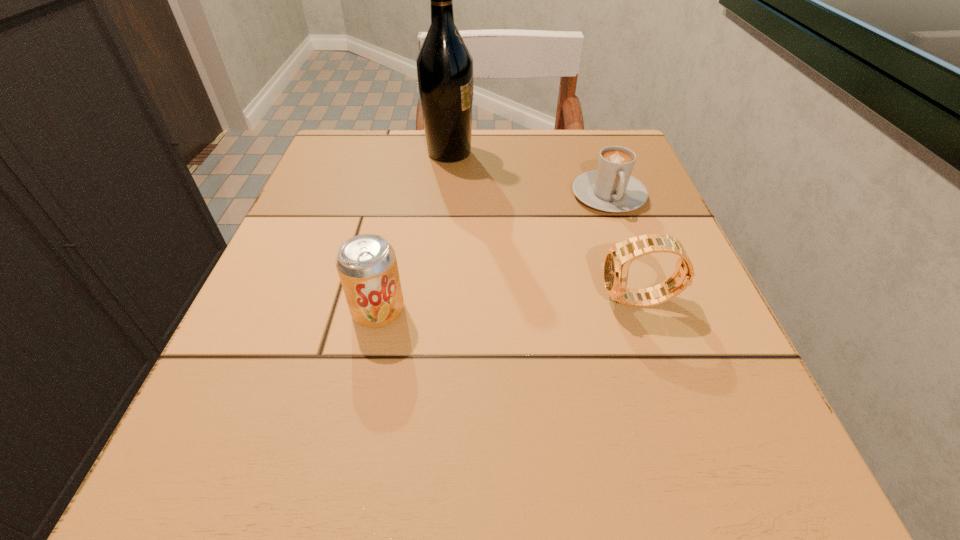
Locate an element on the screen. free space located 0.100m on the face of the watch is located at coordinates (534, 301).

This screenshot has height=540, width=960. Identify the location of vacant space located to the right of the cappuccino. (671, 370).

At what (x,y) coordinates should I click in order to perform the action: click on wine bottle that is at the far edge. Please return your answer as a coordinate pair (x, y). Looking at the image, I should click on (444, 64).

Locate an element on the screen. cappuccino at the far edge is located at coordinates (611, 188).

Where is `object located at the left edge`? This screenshot has width=960, height=540. object located at the left edge is located at coordinates (367, 266).

At what (x,y) coordinates should I click in order to perform the action: click on watch located in the right edge section of the desktop. Please return your answer as a coordinate pair (x, y). The height and width of the screenshot is (540, 960). Looking at the image, I should click on (618, 259).

Where is `cappuccino that is at the right edge`? cappuccino that is at the right edge is located at coordinates (611, 188).

The image size is (960, 540). Find the location of `object that is at the far right corner`. object that is at the far right corner is located at coordinates (611, 188).

Locate an element on the screen. This screenshot has width=960, height=540. free space at the far edge of the desktop is located at coordinates tap(466, 183).

At what (x,y) coordinates should I click in order to perform the action: click on vacant space at the near edge of the desktop. Please return your answer as a coordinate pair (x, y). The height and width of the screenshot is (540, 960). Looking at the image, I should click on (562, 474).